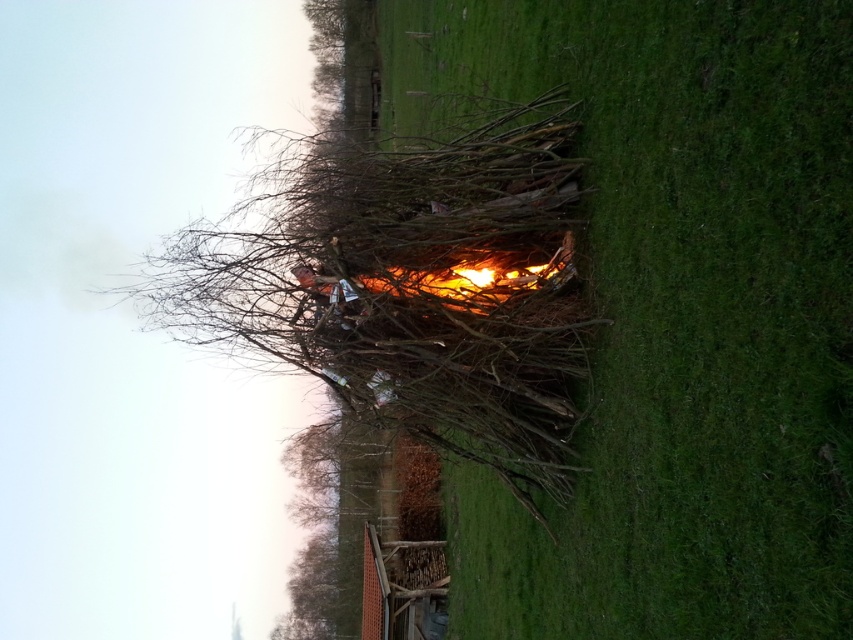
Can you confirm if green grass at center is thinner than bare branches at center?

Indeed, green grass at center has a lesser width compared to bare branches at center.

Is green grass at center wider than bare branches at center?

No.

This screenshot has width=853, height=640. Describe the element at coordinates (674, 312) in the screenshot. I see `green grass at center` at that location.

I want to click on green grass at center, so click(x=674, y=312).

In the scene shown: Can you confirm if bare branches at center is positioned below flaming wood at center?

Actually, bare branches at center is above flaming wood at center.

Who is lower down, bare branches at center or flaming wood at center?

flaming wood at center

Is point (543, 273) more distant than point (466, 268)?

That is True.

The image size is (853, 640). Identify the location of bare branches at center. (412, 285).

Can you confirm if green grass at center is shorter than flaming wood at center?

No, green grass at center is not shorter than flaming wood at center.

Does point (625, 422) lie behind point (416, 269)?

No, (625, 422) is closer to viewer.

You are a GUI agent. You are given a task and a screenshot of the screen. Output one action in this format:
    pyautogui.click(x=<x>, y=<y>)
    Task: Click on the green grass at center
    The width and height of the screenshot is (853, 640).
    Given the screenshot: What is the action you would take?
    pyautogui.click(x=674, y=312)

Locate an element on the screen. This screenshot has width=853, height=640. green grass at center is located at coordinates (674, 312).